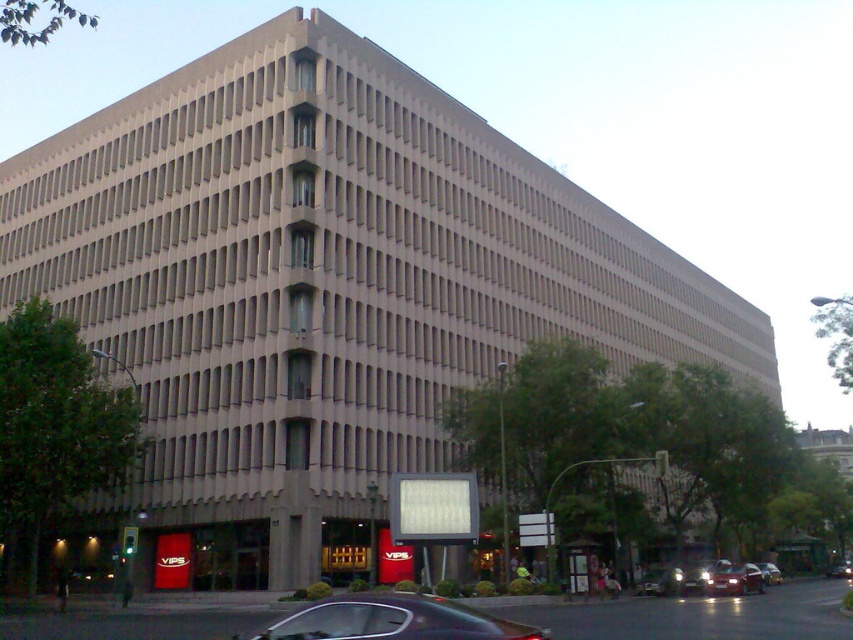
Question: Which object appears farthest from the camera in this image?

Choices:
 (A) shiny black sedan at lower center
 (B) shiny silver car at center
 (C) metallic silver car at center
 (D) shiny silver sedan at center

Answer: (C)

Question: Which object appears closest to the camera in this image?

Choices:
 (A) shiny black sedan at lower center
 (B) metallic silver car at center

Answer: (A)

Question: Which object is positioned farthest from the shiny black sedan at lower center?

Choices:
 (A) shiny silver sedan at center
 (B) metallic silver car at center
 (C) shiny silver car at center

Answer: (B)

Question: Does shiny black sedan at lower center have a lesser width compared to shiny silver car at center?

Choices:
 (A) yes
 (B) no

Answer: (B)

Question: Does shiny black sedan at lower center have a greater width compared to metallic silver car at center?

Choices:
 (A) yes
 (B) no

Answer: (A)

Question: Does shiny silver car at center appear on the right side of metallic silver car at center?

Choices:
 (A) no
 (B) yes

Answer: (A)